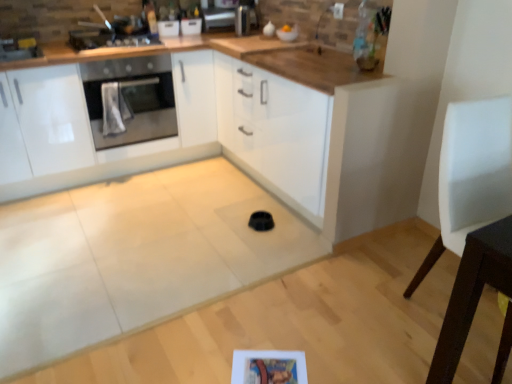
Question: From a real-world perspective, is satin silver toaster at upper center located higher than white leather chair at right?

Choices:
 (A) no
 (B) yes

Answer: (B)

Question: Can you confirm if satin silver toaster at upper center is positioned to the right of white leather chair at right?

Choices:
 (A) yes
 (B) no

Answer: (B)

Question: Considering the relative positions of satin silver toaster at upper center and white leather chair at right in the image provided, is satin silver toaster at upper center behind white leather chair at right?

Choices:
 (A) yes
 (B) no

Answer: (A)

Question: Considering the relative sizes of satin silver toaster at upper center and white leather chair at right in the image provided, is satin silver toaster at upper center thinner than white leather chair at right?

Choices:
 (A) yes
 (B) no

Answer: (A)

Question: Is white leather chair at right completely or partially inside satin silver toaster at upper center?

Choices:
 (A) yes
 (B) no

Answer: (B)

Question: Is satin silver toaster at upper center positioned far away from white leather chair at right?

Choices:
 (A) yes
 (B) no

Answer: (A)

Question: Is white leather chair at right oriented towards satin silver toaster at upper center?

Choices:
 (A) no
 (B) yes

Answer: (A)

Question: Is white leather chair at right wider than satin silver toaster at upper center?

Choices:
 (A) yes
 (B) no

Answer: (A)

Question: From the image's perspective, is white leather chair at right under satin silver toaster at upper center?

Choices:
 (A) yes
 (B) no

Answer: (A)

Question: Is white leather chair at right thinner than satin silver toaster at upper center?

Choices:
 (A) no
 (B) yes

Answer: (A)

Question: Is white leather chair at right outside satin silver toaster at upper center?

Choices:
 (A) no
 (B) yes

Answer: (B)

Question: Is white leather chair at right beside satin silver toaster at upper center?

Choices:
 (A) no
 (B) yes

Answer: (A)

Question: Can you see stainless steel oven at left touching metallic stainless steel oven at upper left?

Choices:
 (A) no
 (B) yes

Answer: (A)